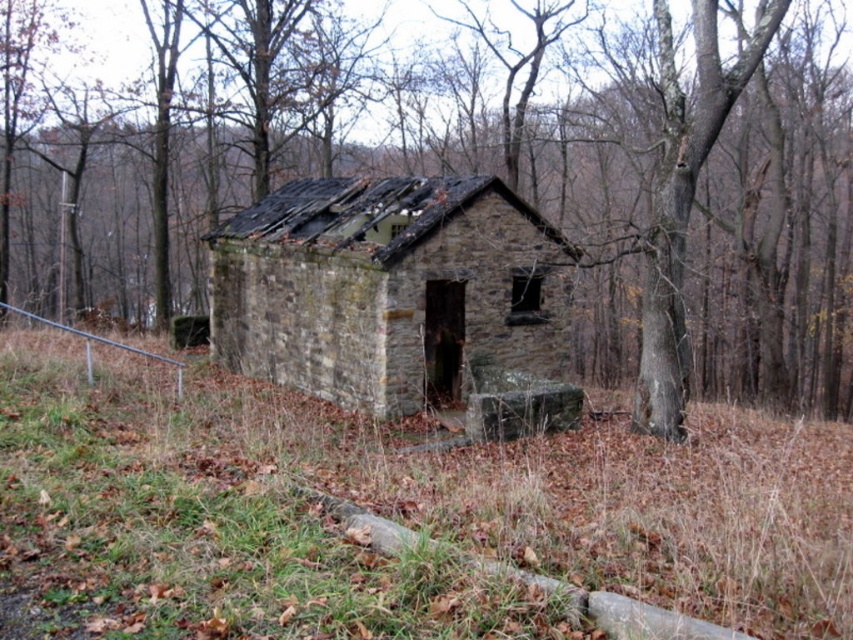
You are a hiker lost in the woods and see the brown rough bark tree at center and the rusty stone hut at center. Which one is more to the left?

The brown rough bark tree at center is more to the left because it is positioned on the left side of the rusty stone hut at center.

You are a hiker who has stumbled upon this abandoned area. You notice a brown rough bark tree at center and a rusty stone hut at center. Which object is located above the other?

The brown rough bark tree at center is positioned over the rusty stone hut at center, so the tree is above the hut.

You are standing in front of the dilapidated stone structure. You want to take a photo of the brown rough bark tree at center from the best possible angle. Where should you position yourself relative to the structure?

The brown rough bark tree at center is located at point (548, 232), so you should position yourself to the right side of the structure to capture the tree at that coordinate.